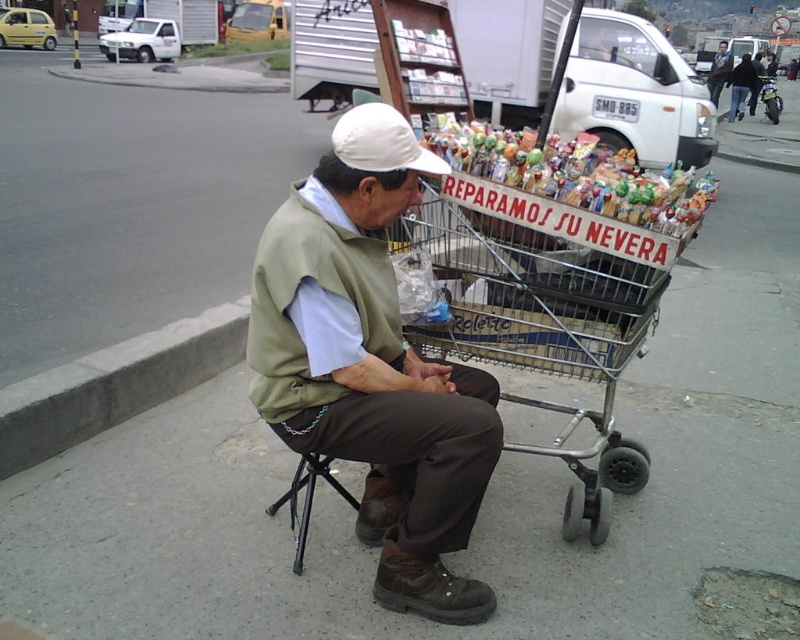
Question: Which point is farther to the camera?

Choices:
 (A) white fabric baseball cap at center
 (B) concrete at lower left

Answer: (B)

Question: Does concrete at lower left appear on the right side of dark blue jeans at lower center?

Choices:
 (A) no
 (B) yes

Answer: (A)

Question: Among these points, which one is nearest to the camera?

Choices:
 (A) (298, 369)
 (B) (52, 449)
 (C) (450, 256)
 (D) (722, 76)

Answer: (A)

Question: Among these points, which one is nearest to the camera?

Choices:
 (A) 374,589
 (B) 716,102

Answer: (A)

Question: Does matte green vest at center appear on the left side of metallic silver shopping cart at center?

Choices:
 (A) no
 (B) yes

Answer: (B)

Question: Can you confirm if matte green vest at center is positioned to the left of concrete at lower left?

Choices:
 (A) no
 (B) yes

Answer: (A)